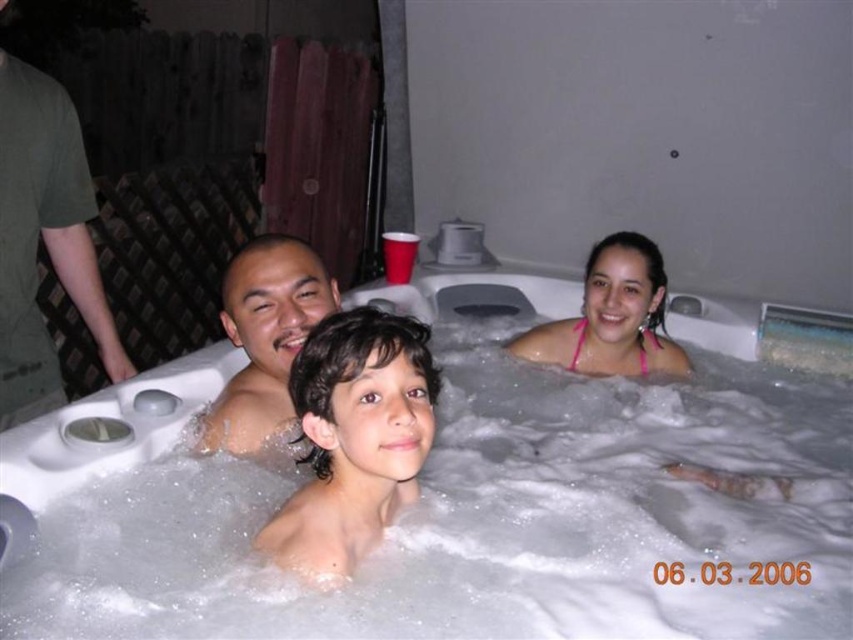
Question: Is dark brown hair at center behind smooth skin man at center?

Choices:
 (A) no
 (B) yes

Answer: (A)

Question: Which point appears closest to the camera in this image?

Choices:
 (A) (247, 433)
 (B) (309, 413)
 (C) (512, 516)

Answer: (B)

Question: Which point is closer to the camera?

Choices:
 (A) smooth skin man at center
 (B) dark brown hair at center
 (C) white bubbly foam at center

Answer: (B)

Question: Is dark brown hair at center wider than smooth skin man at center?

Choices:
 (A) yes
 (B) no

Answer: (B)

Question: Which point appears closest to the camera in this image?

Choices:
 (A) (334, 381)
 (B) (473, 406)
 (C) (277, 317)

Answer: (A)

Question: Is dark brown hair at center below smooth skin man at center?

Choices:
 (A) no
 (B) yes

Answer: (B)